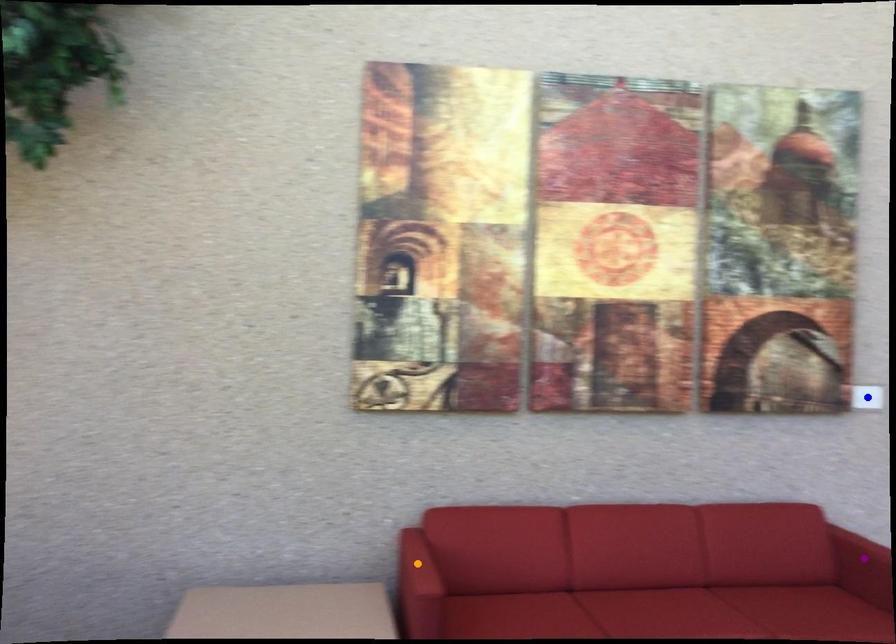
Based on the photo, order these from nearest to farthest:
blue point | purple point | orange point

blue point
purple point
orange point